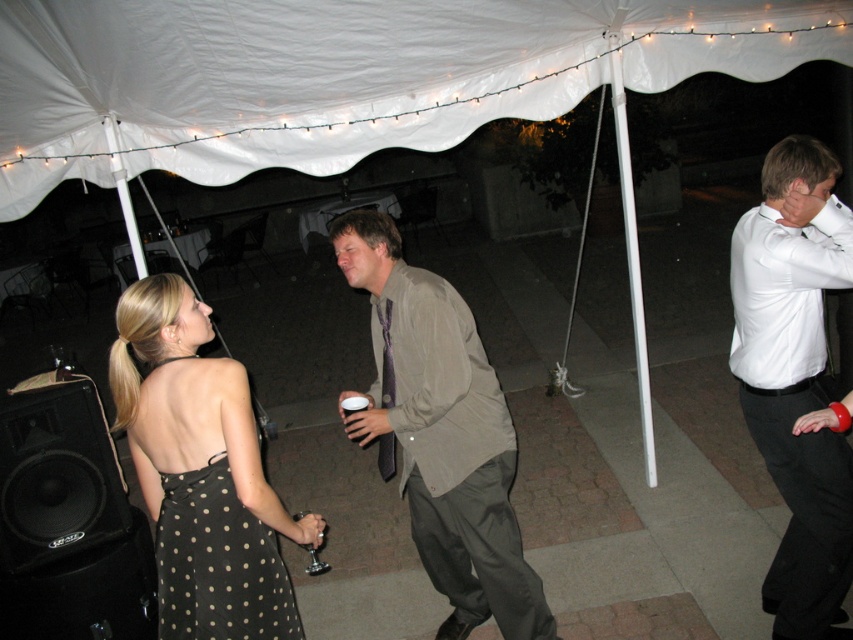
Question: Does white glossy shirt at upper right have a lesser width compared to black polka dot fabric dress at lower left?

Choices:
 (A) no
 (B) yes

Answer: (A)

Question: Which of the following is the closest to the observer?

Choices:
 (A) (x=764, y=372)
 (B) (x=77, y=508)

Answer: (A)

Question: Is white glossy shirt at upper right bigger than black plastic speaker at lower left?

Choices:
 (A) no
 (B) yes

Answer: (B)

Question: Which of the following is the closest to the observer?

Choices:
 (A) white glossy shirt at upper right
 (B) black plastic speaker at lower left
 (C) matte khaki shirt at center
 (D) black polka dot fabric dress at lower left

Answer: (D)

Question: Is matte khaki shirt at center closer to the viewer compared to black satin dress at center?

Choices:
 (A) no
 (B) yes

Answer: (A)

Question: Among these objects, which one is farthest from the camera?

Choices:
 (A) white glossy shirt at upper right
 (B) black plastic speaker at lower left
 (C) matte khaki shirt at center

Answer: (B)